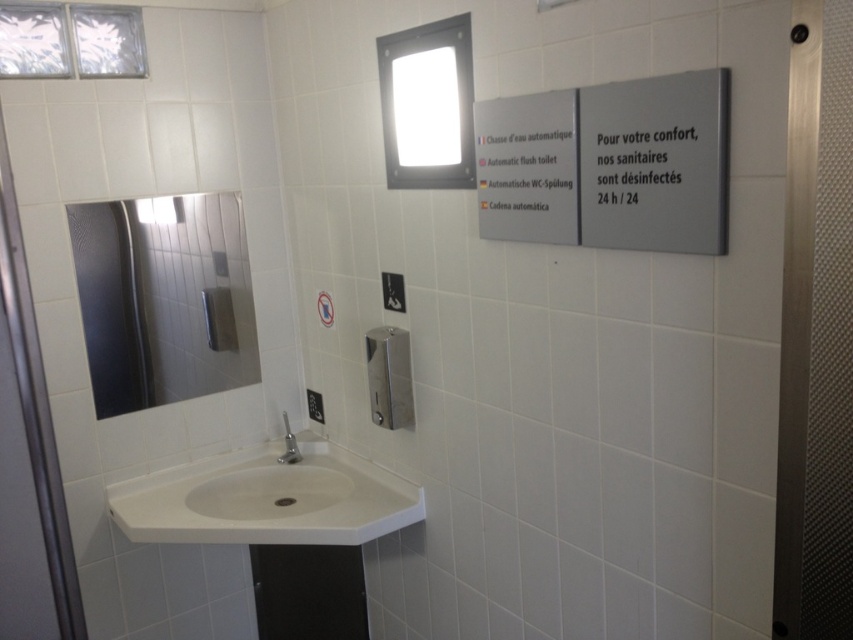
You are standing in the restroom corner and want to touch both points mentioned. Which point should you reach for first, the point at coordinates point(160, 227) or point(618, 125)?

You should reach for point(160, 227) first because it is closer to you than point(618, 125).

In the scene shown: You are a maintenance worker who needs to clean the gray matte sign at upper right and the white glossy sink at lower center. Which one is positioned higher on the wall?

The gray matte sign at upper right is located above the white glossy sink at lower center, so it is positioned higher on the wall.

You are a maintenance worker checking the restroom facilities. You need to determine if the gray matte sign at upper right can be replaced with a new sign that is 10 cm taller than the current one. Given the white glossy sink at lower center is currently 40 cm in height, is there enough vertical space above the sink to install the taller sign without overlapping the sink?

The gray matte sign at upper right is taller than the white glossy sink at lower center. Since the new sign would be 10 cm taller than the current one, which is already taller than the sink, there might not be sufficient vertical space above the sink to accommodate the taller sign without overlapping. However, the exact answer depends on the current height of the sign and the available space between the sign and the sink, which isn